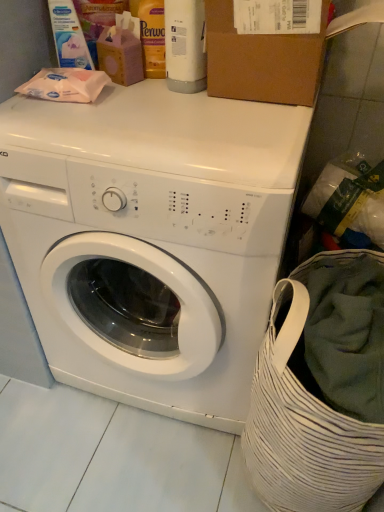
Question: Does matte white wipes at upper left, the first cleaning product viewed from the left, appear on the left side of brown cardboard box at upper center?

Choices:
 (A) yes
 (B) no

Answer: (A)

Question: From the image's perspective, is matte white wipes at upper left, the first cleaning product viewed from the left, on top of brown cardboard box at upper center?

Choices:
 (A) no
 (B) yes

Answer: (B)

Question: Could you tell me if matte white wipes at upper left, the first cleaning product viewed from the left, is facing brown cardboard box at upper center?

Choices:
 (A) no
 (B) yes

Answer: (A)

Question: Is matte white wipes at upper left, the first cleaning product viewed from the left, wider than brown cardboard box at upper center?

Choices:
 (A) yes
 (B) no

Answer: (B)

Question: Is matte white wipes at upper left, the first cleaning product viewed from the left, bigger than brown cardboard box at upper center?

Choices:
 (A) yes
 (B) no

Answer: (B)

Question: Is brown cardboard box at upper center taller or shorter than matte white wipes at upper left, which is counted as the second cleaning product, starting from the right?

Choices:
 (A) tall
 (B) short

Answer: (B)

Question: Looking at their shapes, would you say brown cardboard box at upper center is wider or thinner than matte white wipes at upper left, the first cleaning product viewed from the left?

Choices:
 (A) wide
 (B) thin

Answer: (A)

Question: Does point 296,82 appear closer or farther from the camera than point 86,53?

Choices:
 (A) farther
 (B) closer

Answer: (B)

Question: Based on their sizes in the image, would you say brown cardboard box at upper center is bigger or smaller than matte white wipes at upper left, which is counted as the second cleaning product, starting from the right?

Choices:
 (A) small
 (B) big

Answer: (B)

Question: In the image, is matte white wipes at upper left, the first cleaning product viewed from the left, on the left side or the right side of brown cardboard box at upper center?

Choices:
 (A) right
 (B) left

Answer: (B)

Question: Is matte white wipes at upper left, the first cleaning product viewed from the left, in front of or behind brown cardboard box at upper center in the image?

Choices:
 (A) behind
 (B) front

Answer: (A)

Question: Considering the positions of matte white wipes at upper left, the first cleaning product viewed from the left, and brown cardboard box at upper center in the image, is matte white wipes at upper left, the first cleaning product viewed from the left, wider or thinner than brown cardboard box at upper center?

Choices:
 (A) thin
 (B) wide

Answer: (A)

Question: Based on their sizes in the image, would you say matte white wipes at upper left, which is counted as the second cleaning product, starting from the right, is bigger or smaller than brown cardboard box at upper center?

Choices:
 (A) small
 (B) big

Answer: (A)

Question: Is white glossy bottle at upper center, acting as the 1th cleaning product starting from the right, in front of or behind matte white wipes at upper left, which is counted as the second cleaning product, starting from the right, in the image?

Choices:
 (A) front
 (B) behind

Answer: (A)

Question: From a real-world perspective, relative to matte white wipes at upper left, which is counted as the second cleaning product, starting from the right, is white glossy bottle at upper center, acting as the 1th cleaning product starting from the right, vertically above or below?

Choices:
 (A) above
 (B) below

Answer: (A)